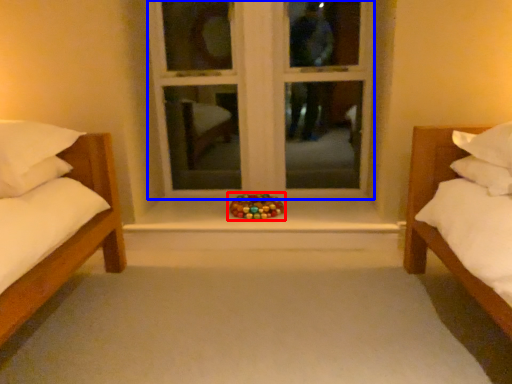
Question: Which object appears closest to the camera in this image, toy (highlighted by a red box) or window frame (highlighted by a blue box)?

Choices:
 (A) toy
 (B) window frame

Answer: (A)